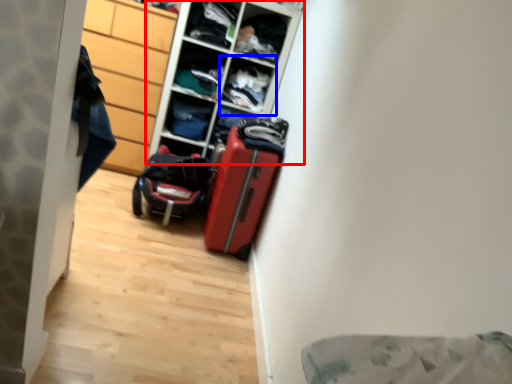
Question: Among these objects, which one is farthest to the camera, shelf (highlighted by a red box) or cabinet (highlighted by a blue box)?

Choices:
 (A) shelf
 (B) cabinet

Answer: (B)